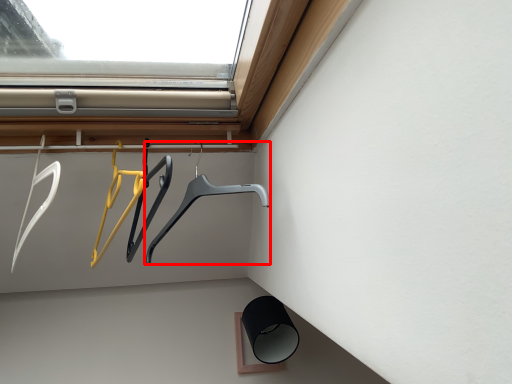
Question: From the image's perspective, what is the correct spatial relationship of hanger (annotated by the red box) in relation to hanger?

Choices:
 (A) above
 (B) below

Answer: (B)